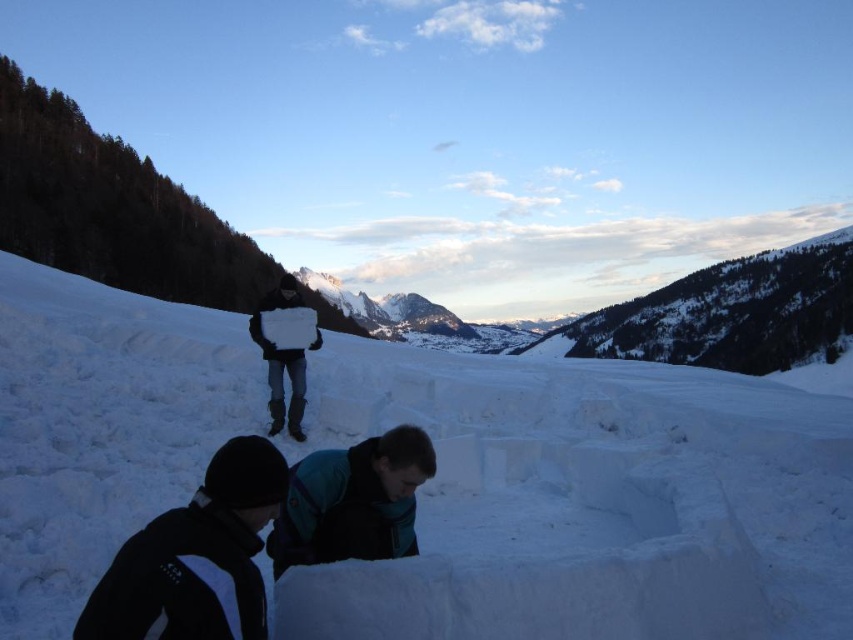
Question: Among these points, which one is farthest from the camera?

Choices:
 (A) (373, 451)
 (B) (376, 636)
 (C) (273, 380)
 (D) (393, 448)

Answer: (C)

Question: Is teal fabric jacket at lower center above white paper at center?

Choices:
 (A) yes
 (B) no

Answer: (B)

Question: Which point is closer to the camera?

Choices:
 (A) (276, 353)
 (B) (247, 636)

Answer: (B)

Question: Is black soft jacket at lower center above white paper at center?

Choices:
 (A) yes
 (B) no

Answer: (B)

Question: Considering the relative positions of teal fabric jacket at lower center and white paper at center in the image provided, where is teal fabric jacket at lower center located with respect to white paper at center?

Choices:
 (A) above
 (B) below

Answer: (B)

Question: Among these points, which one is nearest to the camera?

Choices:
 (A) (277, 406)
 (B) (364, 440)
 (C) (196, 570)

Answer: (C)